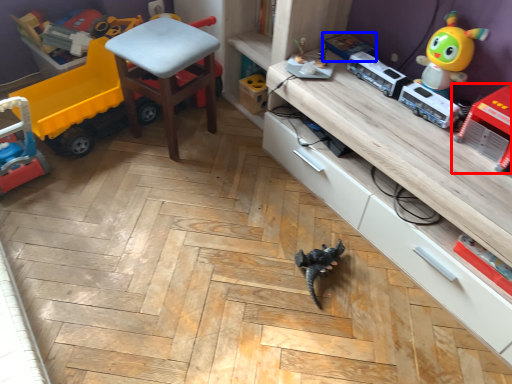
Question: Which of the following is the farthest to the observer, toy (highlighted by a red box) or toy (highlighted by a blue box)?

Choices:
 (A) toy
 (B) toy

Answer: (B)